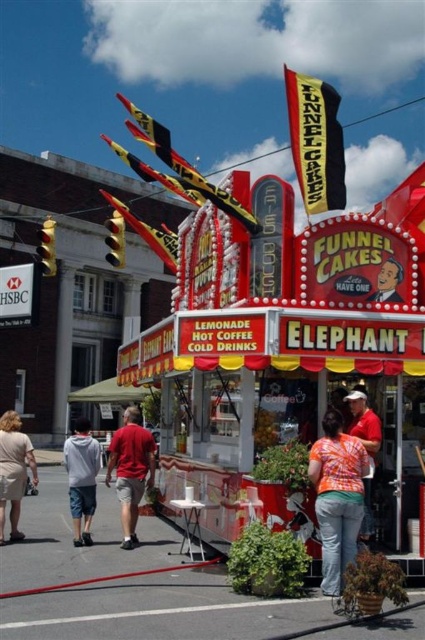
In the scene shown: You are a customer at the funnel cake stand. You see the beige fabric dress at lower left and the smooth plastic sign at center. Which object is closer to your left side?

The beige fabric dress at lower left is closer to your left side because it is positioned to the left of the smooth plastic sign at center.

You are a customer standing at the entrance of the funnel cake stand and see the matte red shirt at center and the orange printed shirt at center. Which shirt is closer to you?

The matte red shirt at center and orange printed shirt at center are 40.23 feet apart from each other, so without additional information about their positions relative to the entrance, it is impossible to determine which is closer to you.